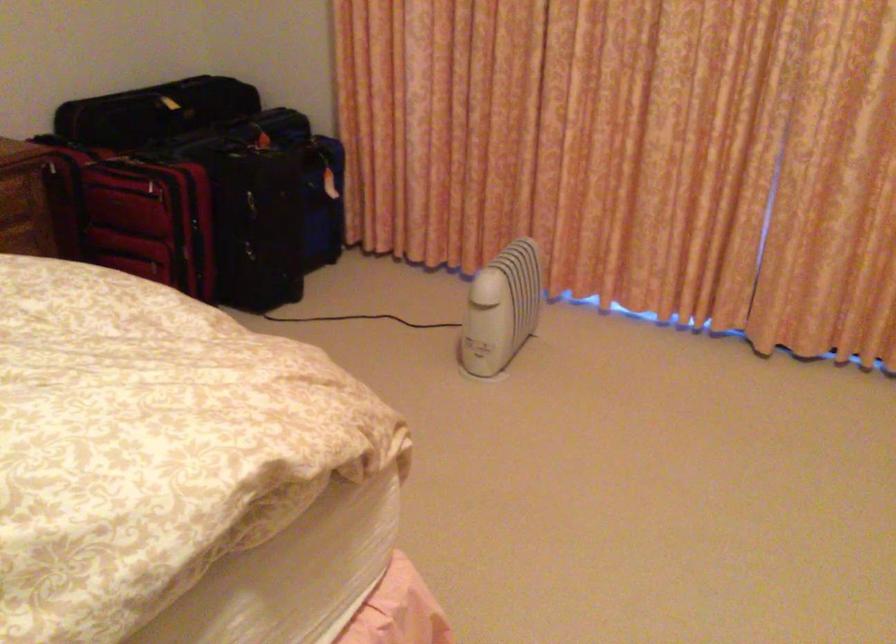
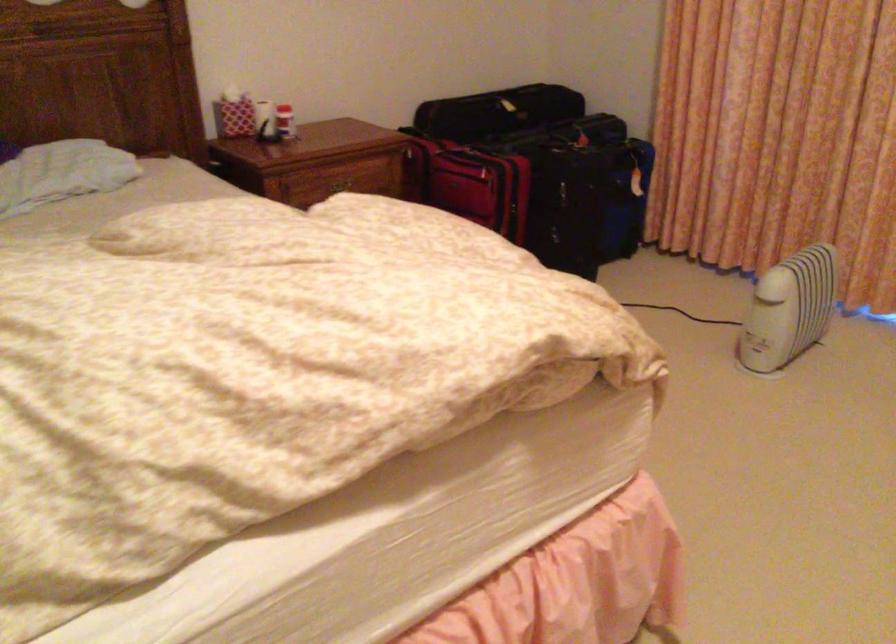
Where in the second image is the point corresponding to point (349, 236) from the first image?

(649, 223)